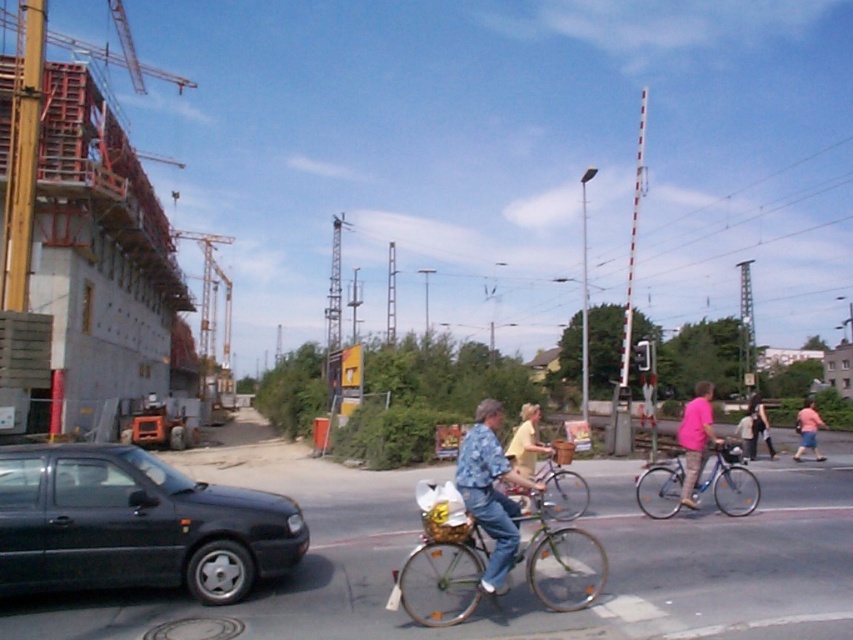
Who is more distant from viewer, (556, 476) or (694, 477)?

Positioned behind is point (556, 476).

Can you confirm if metallic silver bicycle at center is positioned below pink fabric shirt at center?

Actually, metallic silver bicycle at center is above pink fabric shirt at center.

What do you see at coordinates (561, 490) in the screenshot?
I see `metallic silver bicycle at center` at bounding box center [561, 490].

Identify the location of metallic silver bicycle at center. Image resolution: width=853 pixels, height=640 pixels. (561, 490).

Can you confirm if green matte bicycle at center is positioned above shiny silver bicycle at center?

No, green matte bicycle at center is not above shiny silver bicycle at center.

Which is more to the left, green matte bicycle at center or shiny silver bicycle at center?

green matte bicycle at center

The image size is (853, 640). Identify the location of green matte bicycle at center. (440, 577).

Find the location of `green matte bicycle at center`. green matte bicycle at center is located at coordinates (440, 577).

Does point (56, 476) come closer to viewer compared to point (556, 483)?

That is True.

The width and height of the screenshot is (853, 640). I want to click on matte black car at left, so click(x=135, y=524).